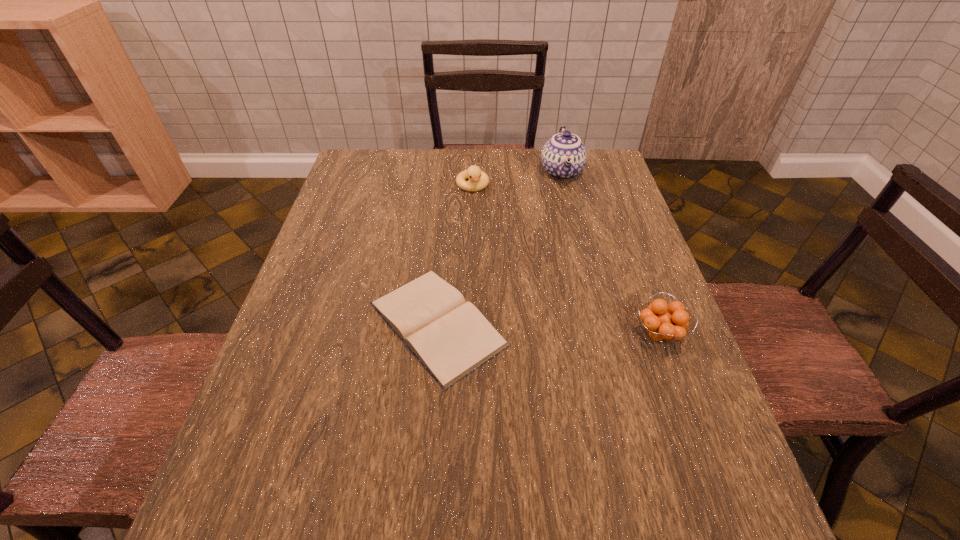
Identify the location of free point located 0.290m from the spout of the tallest object. Image resolution: width=960 pixels, height=540 pixels. (570, 255).

This screenshot has height=540, width=960. Find the location of `free point located from the spout of the tallest object`. free point located from the spout of the tallest object is located at coordinates (568, 234).

Locate an element on the screen. The height and width of the screenshot is (540, 960). duckling located in the far edge section of the desktop is located at coordinates (478, 180).

At what (x,y) coordinates should I click in order to perform the action: click on chinaware present at the far edge. Please return your answer as a coordinate pair (x, y). The image size is (960, 540). Looking at the image, I should click on (563, 157).

Where is `orange fruit situated at the right edge`? Image resolution: width=960 pixels, height=540 pixels. orange fruit situated at the right edge is located at coordinates (661, 326).

Where is `chinaware that is at the right edge`? This screenshot has height=540, width=960. chinaware that is at the right edge is located at coordinates (563, 157).

Identify the location of object present at the far right corner. The width and height of the screenshot is (960, 540). (563, 157).

The height and width of the screenshot is (540, 960). Identify the location of free region at the far edge of the desktop. (436, 177).

In the image, there is a desktop. Where is `free space at the near edge`? free space at the near edge is located at coordinates (361, 435).

In the image, there is a desktop. Where is `vacant space at the left edge`? This screenshot has width=960, height=540. vacant space at the left edge is located at coordinates (357, 260).